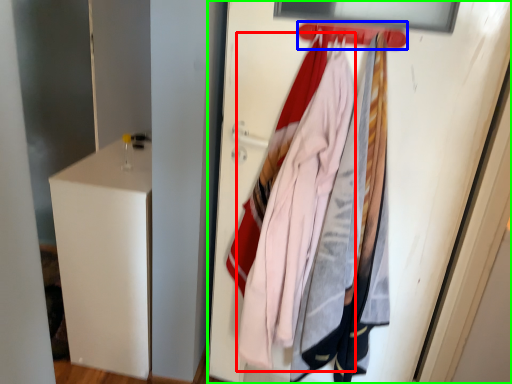
Question: Which object is the closest to the clothing (highlighted by a red box)? Choose among these: hanger (highlighted by a blue box) or door (highlighted by a green box).

Choices:
 (A) hanger
 (B) door

Answer: (B)